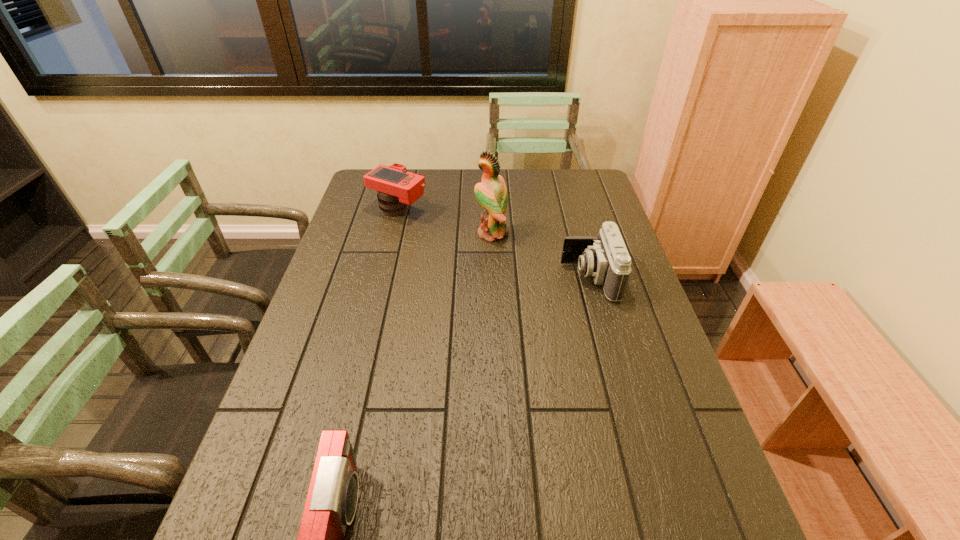
The height and width of the screenshot is (540, 960). Identify the location of free space that is in between the rightmost camera and the tallest object. (540, 256).

Find the location of `unoccupied area between the parrot and the farthest camera`. unoccupied area between the parrot and the farthest camera is located at coordinates point(445,222).

The width and height of the screenshot is (960, 540). Identify the location of unoccupied area between the second object from right to left and the farthest camera. (445, 222).

What are the coordinates of `the closest object to the rightmost object` in the screenshot? It's located at (491, 193).

Identify the location of object that is the third closest to the farthest camera. (331, 503).

This screenshot has height=540, width=960. What are the coordinates of `the closest camera to the second nearest camera` in the screenshot? It's located at (397, 188).

Identify which camera is the nearest to the nearest object. Please provide its 2D coordinates. Your answer should be formatted as a tuple, i.e. [(x, y)], where the tuple contains the x and y coordinates of a point satisfying the conditions above.

[(605, 258)]